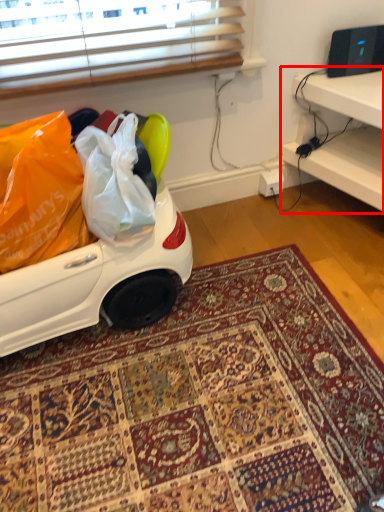
Question: In this image, where is furniture (annotated by the red box) located relative to mat?

Choices:
 (A) left
 (B) right

Answer: (B)